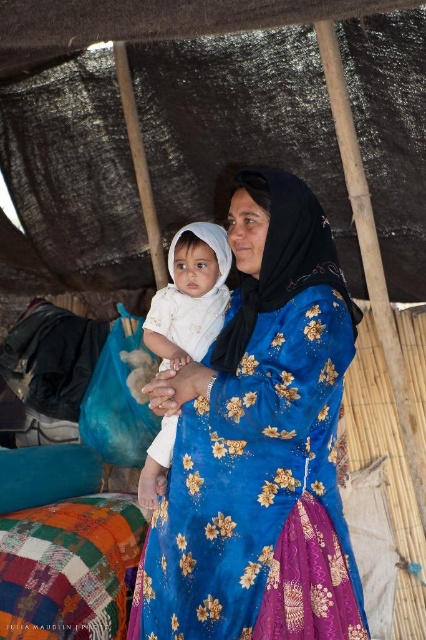
You are a photographer taking a picture of the scene described. You notice two points in the image at coordinates point (x=316, y=506) and point (x=158, y=310). Which point is closer to your camera lens?

Point (x=316, y=506) is closer to the camera than point (x=158, y=310).

You are a photographer trying to capture the woman and baby in the scene. Since the blue satin dress at center and the white cloth at center are both at the center, which one should you focus on to ensure the other is still visible in the background?

The blue satin dress at center is in front of the white cloth at center, so focusing on the blue satin dress at center will keep the white cloth at center visible in the background.

You are a tailor measuring the distance between the blue satin dress at center and the white cloth at center for a custom fitting. The minimum required space for your measuring tape is 60 centimeters. Can you measure them accurately?

The distance between the blue satin dress at center and the white cloth at center is 61.17 centimeters, which is more than the 60 centimeter requirement. Yes, you can measure them accurately with your tape.